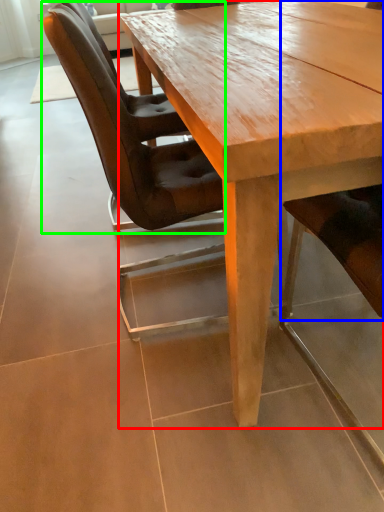
Question: Considering the real-world distances, which object is closest to coffee table (highlighted by a red box)? chair (highlighted by a blue box) or chair (highlighted by a green box).

Choices:
 (A) chair
 (B) chair

Answer: (B)